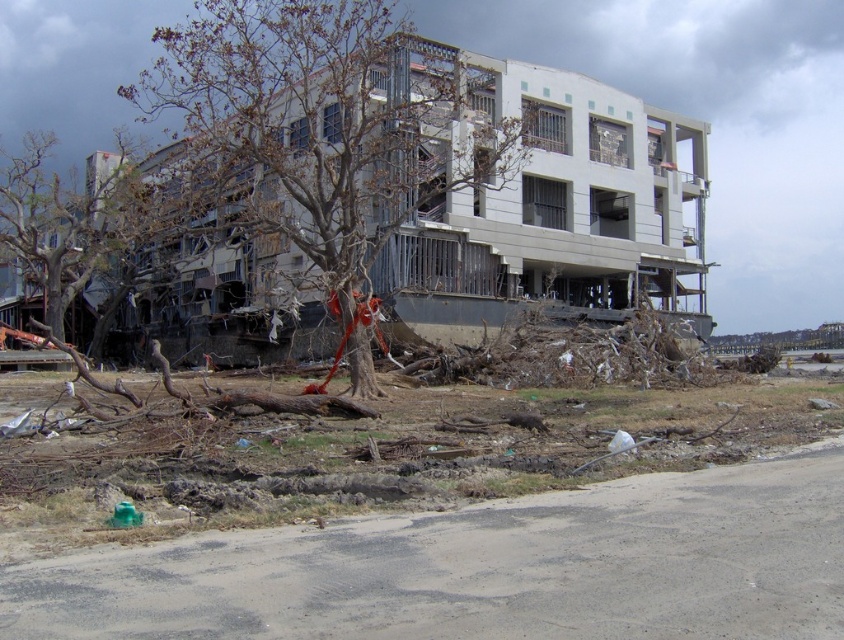
Is point (339, 81) positioned after point (11, 172)?

No, it is in front of (11, 172).

Who is more distant from viewer, (285, 198) or (24, 250)?

Point (24, 250)

Between point (374, 38) and point (31, 176), which one is positioned in front?

Point (374, 38) is more forward.

Where is `brown leafless tree at center`? The width and height of the screenshot is (844, 640). brown leafless tree at center is located at coordinates (326, 129).